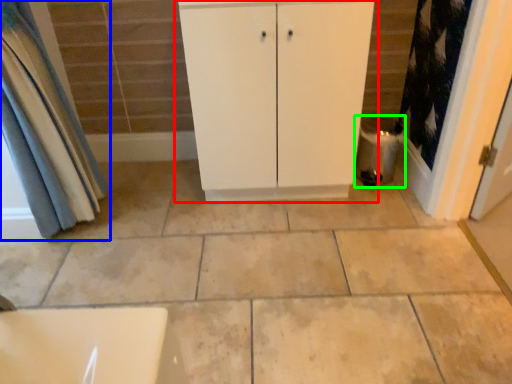
Question: Which is nearer to the bathroom cabinet (highlighted by a red box)? curtain (highlighted by a blue box) or water heater (highlighted by a green box).

Choices:
 (A) curtain
 (B) water heater

Answer: (B)